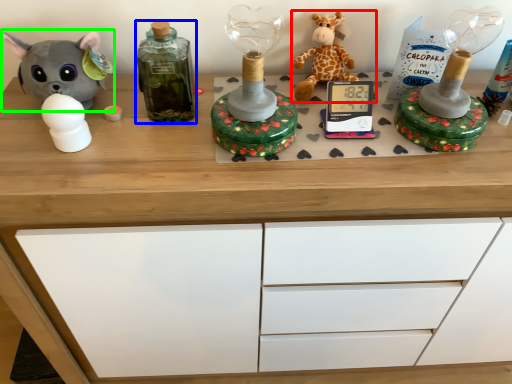
Question: Considering the real-world distances, which object is farthest from toy (highlighted by a red box)? bottle (highlighted by a blue box) or toy (highlighted by a green box)?

Choices:
 (A) bottle
 (B) toy

Answer: (B)